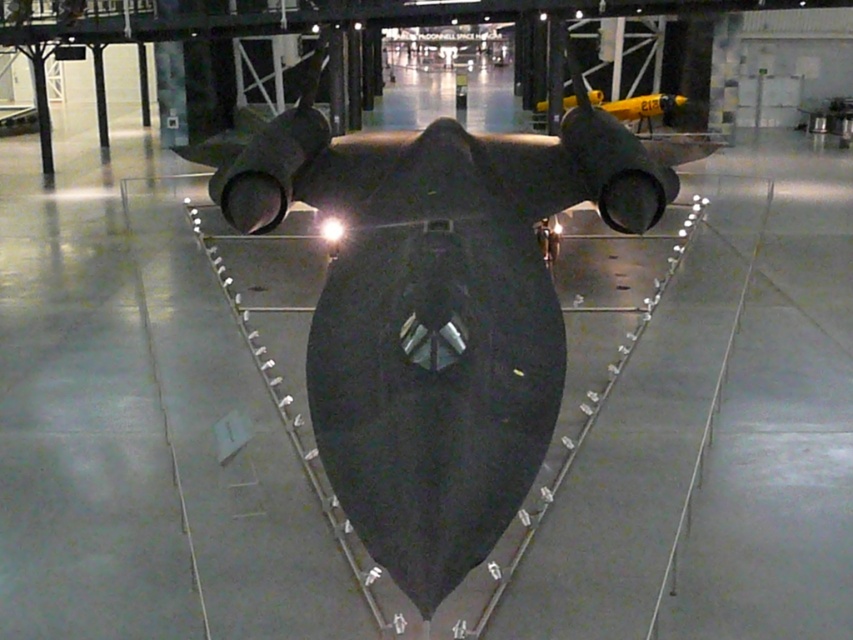
Which is more to the left, matte black aircraft at center or yellow matte airplane at upper center?

matte black aircraft at center

Which of these two, matte black aircraft at center or yellow matte airplane at upper center, stands shorter?

With less height is matte black aircraft at center.

Is point (483, 305) positioned before point (601, 104)?

Yes, point (483, 305) is in front of point (601, 104).

The image size is (853, 640). I want to click on matte black aircraft at center, so click(437, 307).